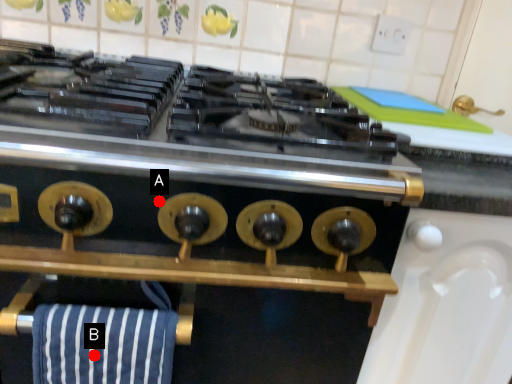
Question: Two points are circled on the image, labeled by A and B beside each circle. Which point is further to the camera?

Choices:
 (A) A is further
 (B) B is further

Answer: (A)